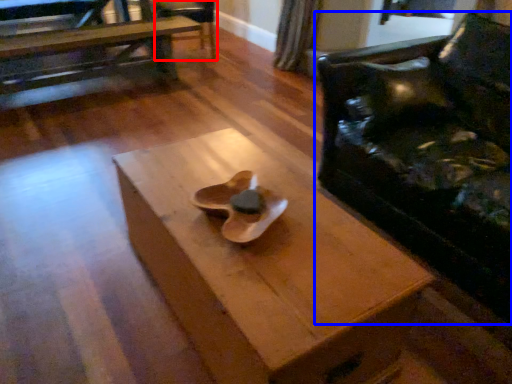
Question: Which of the following is the closest to the observer, armchair (highlighted by a red box) or chair (highlighted by a blue box)?

Choices:
 (A) armchair
 (B) chair

Answer: (B)